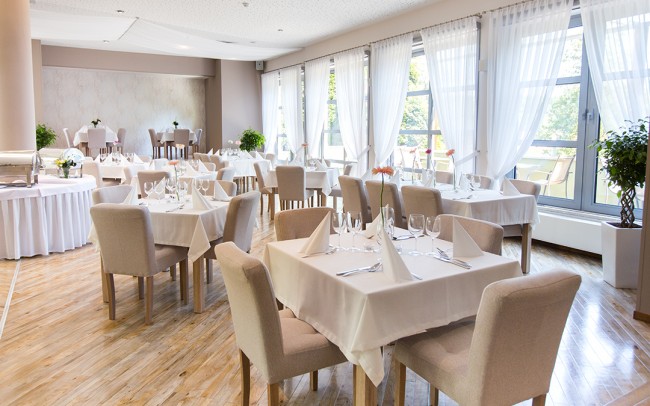
The width and height of the screenshot is (650, 406). In order to click on tables in any context in this screenshot , I will do `click(398, 307)`, `click(190, 222)`, `click(478, 205)`, `click(320, 183)`, `click(247, 167)`, `click(175, 146)`, `click(104, 139)`, `click(58, 214)`.